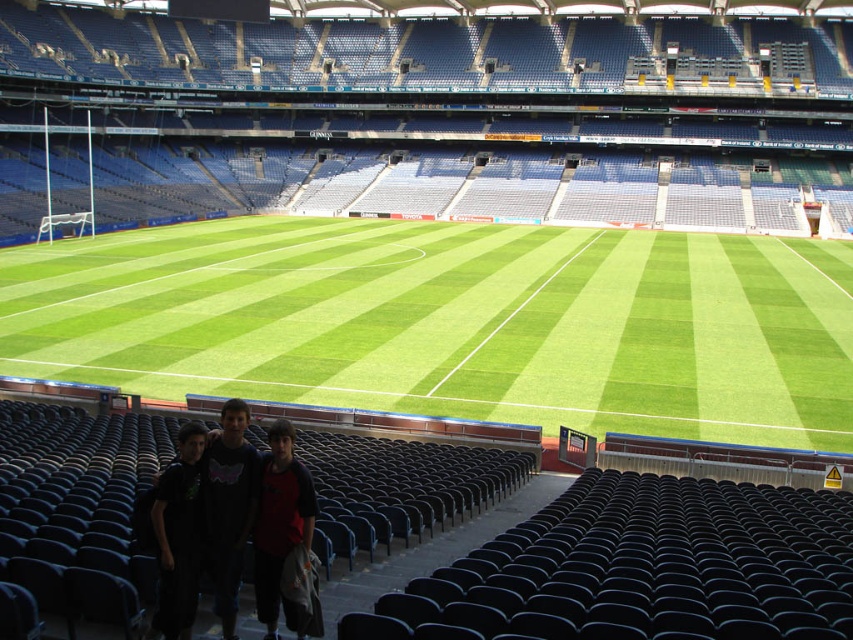
Can you confirm if dark blue t-shirt at lower center is positioned above black matte shirt at lower left?

Correct, dark blue t-shirt at lower center is located above black matte shirt at lower left.

Is point (242, 458) positioned after point (200, 502)?

Yes, it is behind point (200, 502).

At what (x,y) coordinates should I click in order to perform the action: click on dark blue t-shirt at lower center. Please return your answer as a coordinate pair (x, y). Image resolution: width=853 pixels, height=640 pixels. Looking at the image, I should click on (253, 515).

Is point (277, 552) more distant than point (268, 637)?

Yes.

Is dark blue t-shirt at lower center bigger than red fabric shirt at lower center?

Yes, dark blue t-shirt at lower center is bigger than red fabric shirt at lower center.

Who is more forward, (x=288, y=449) or (x=287, y=476)?

Point (x=287, y=476) is in front.

This screenshot has width=853, height=640. I want to click on dark blue t-shirt at lower center, so click(253, 515).

Does green artificial turf at center have a greater height compared to black matte shirt at lower left?

Indeed, green artificial turf at center has a greater height compared to black matte shirt at lower left.

In the scene shown: Is green artificial turf at center below black matte shirt at lower left?

Incorrect, green artificial turf at center is not positioned below black matte shirt at lower left.

Find the location of `green artificial turf at center`. green artificial turf at center is located at coordinates (454, 323).